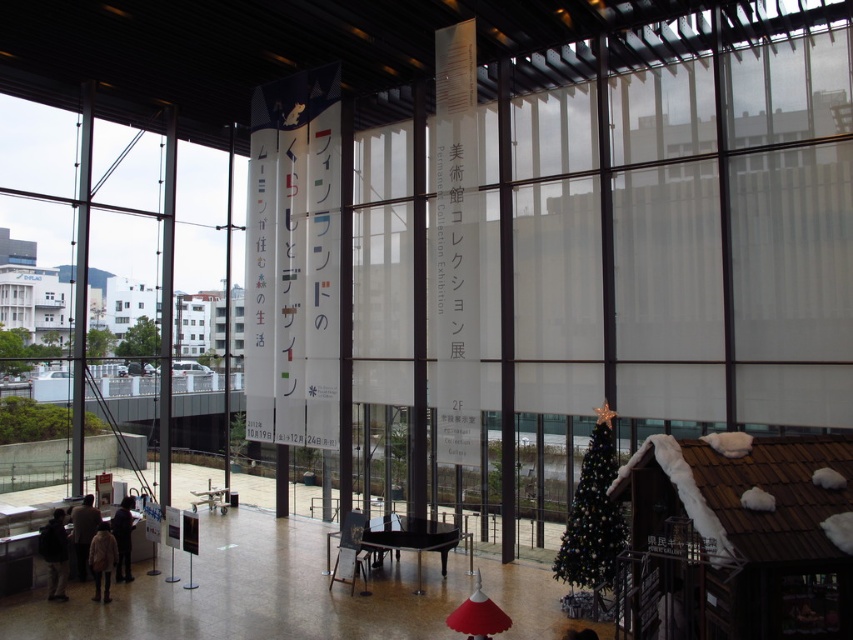
You are a store employee organizing a winter clothing display. You have a light brown fur coat at lower left and a dark gray sweater at lower left. Can you place a 12 inch wide decorative box between them without moving the coats or sweaters?

The light brown fur coat at lower left is 17.02 inches from the dark gray sweater at lower left. Since the decorative box is 12 inches wide, there is enough space between them to place it without moving the coats or sweaters.

You are a customer in a store and you see the light brown fur coat at lower left and the dark gray sweater at lower left. Which one can you carry with you if you have a small shopping bag that can only hold items smaller than the other?

The light brown fur coat at lower left is smaller than the dark gray sweater at lower left, so you can carry the light brown fur coat at lower left in your small shopping bag.